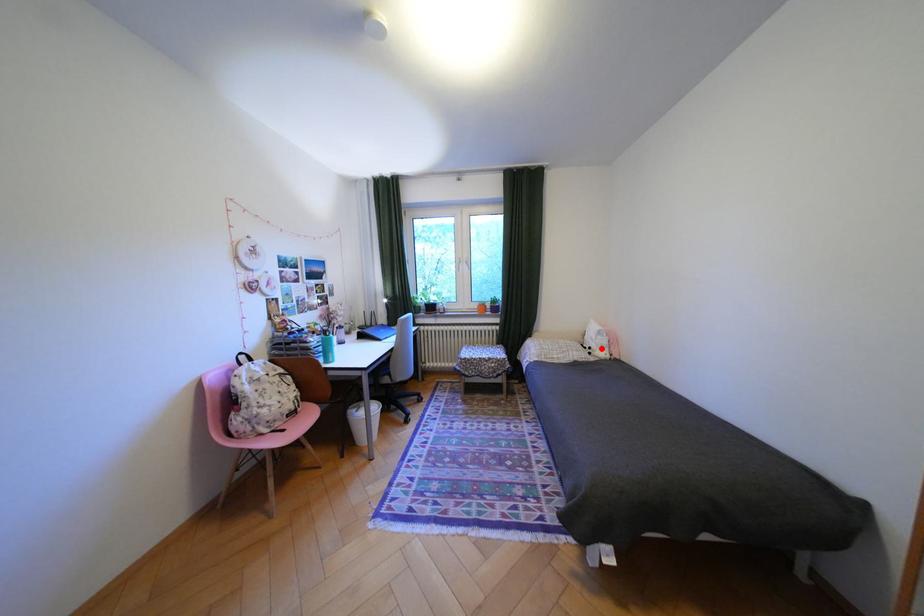
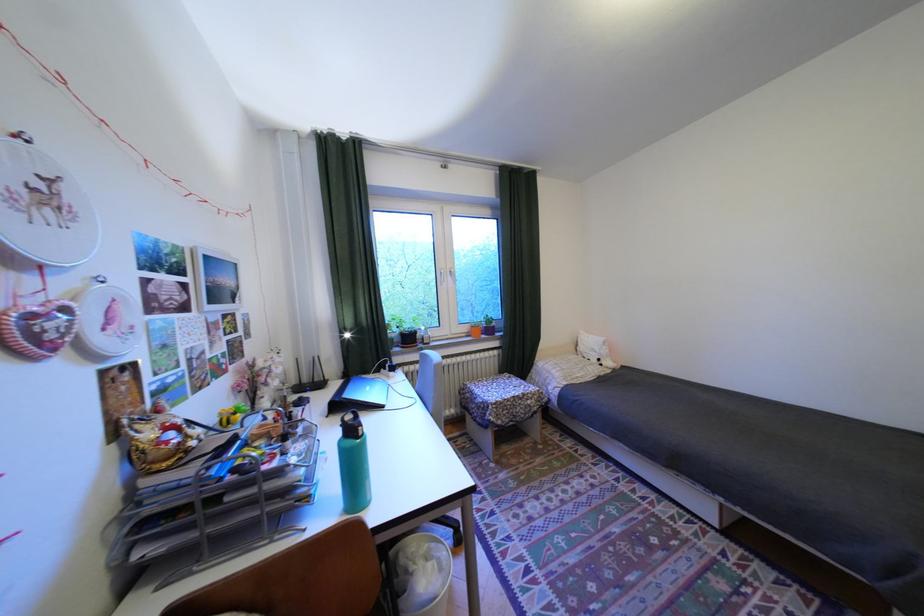
Question: I am providing you with two images of the same scene from different viewpoints. Image1 has a red point marked. In image2, the corresponding 3D location appears at what relative position? Reply with the corresponding letter.

Choices:
 (A) Closer
 (B) Farther

Answer: (B)